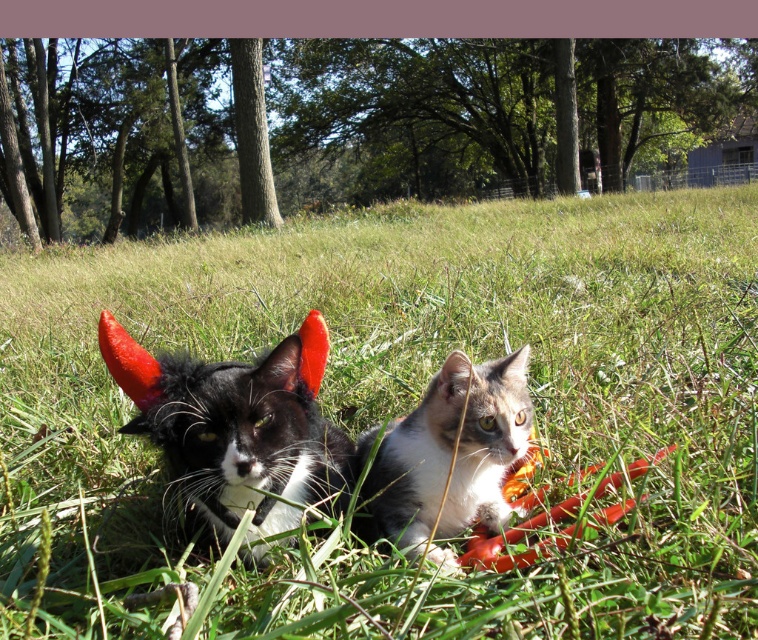
Question: Which point is farther to the camera?

Choices:
 (A) (609, 522)
 (B) (663, 579)
 (C) (421, 397)

Answer: (C)

Question: Which object appears farthest from the camera in this image?

Choices:
 (A) black matte fur cat at center
 (B) rubber chew toy at lower center

Answer: (B)

Question: Which object is positioned closest to the tabby fur cat at center?

Choices:
 (A) black matte fur cat at center
 (B) green grass at center
 (C) rubber chew toy at lower center

Answer: (C)

Question: Does green grass at center appear on the left side of tabby fur cat at center?

Choices:
 (A) yes
 (B) no

Answer: (B)

Question: Does black matte fur cat at center appear under tabby fur cat at center?

Choices:
 (A) yes
 (B) no

Answer: (B)

Question: From the image, what is the correct spatial relationship of green grass at center in relation to rubber chew toy at lower center?

Choices:
 (A) above
 (B) below

Answer: (A)